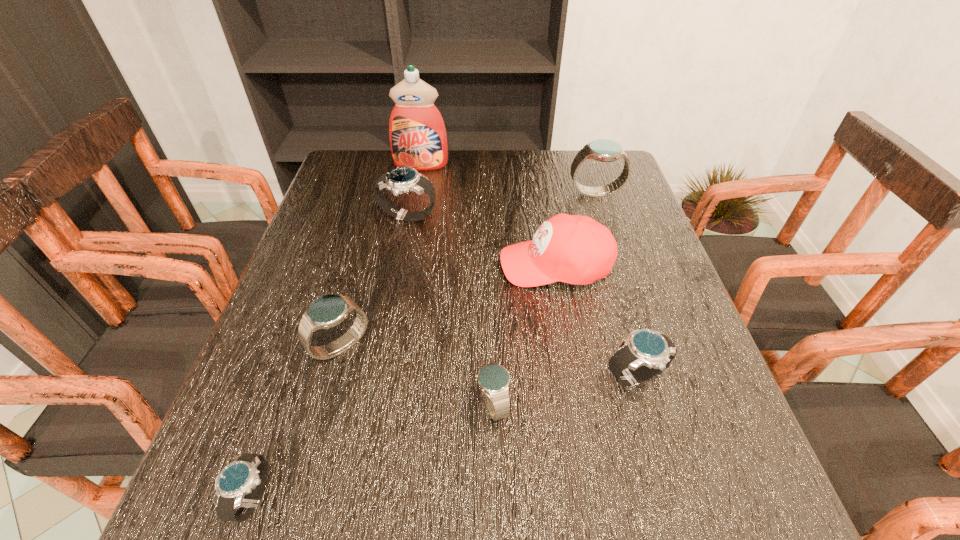
Identify which silver watch is located as the third nearest to the nearest blue watch. Please provide its 2D coordinates. Your answer should be formatted as a tuple, i.e. [(x, y)], where the tuple contains the x and y coordinates of a point satisfying the conditions above.

[(403, 179)]

Locate an element on the screen. The height and width of the screenshot is (540, 960). vacant space that satisfies the following two spatial constraints: 1. on the front panel of the fifth nearest object; 2. on the left side of the rightmost silver watch is located at coordinates (575, 377).

This screenshot has width=960, height=540. Identify the location of vacant area in the image that satisfies the following two spatial constraints: 1. on the front panel of the rightmost silver watch; 2. on the left side of the baseball cap. (575, 377).

The width and height of the screenshot is (960, 540). I want to click on blank space that satisfies the following two spatial constraints: 1. on the front side of the second smallest blue watch; 2. on the right side of the smallest blue watch, so point(324,404).

At what (x,y) coordinates should I click in order to perform the action: click on vacant area in the image that satisfies the following two spatial constraints: 1. on the front panel of the baseball cap; 2. on the right side of the rightmost silver watch. Please return your answer as a coordinate pair (x, y). Image resolution: width=960 pixels, height=540 pixels. Looking at the image, I should click on (575, 377).

Where is `vacant space that satisfies the following two spatial constraints: 1. on the front side of the leftmost blue watch; 2. on the left side of the nearest blue watch`? Image resolution: width=960 pixels, height=540 pixels. vacant space that satisfies the following two spatial constraints: 1. on the front side of the leftmost blue watch; 2. on the left side of the nearest blue watch is located at coordinates (324, 404).